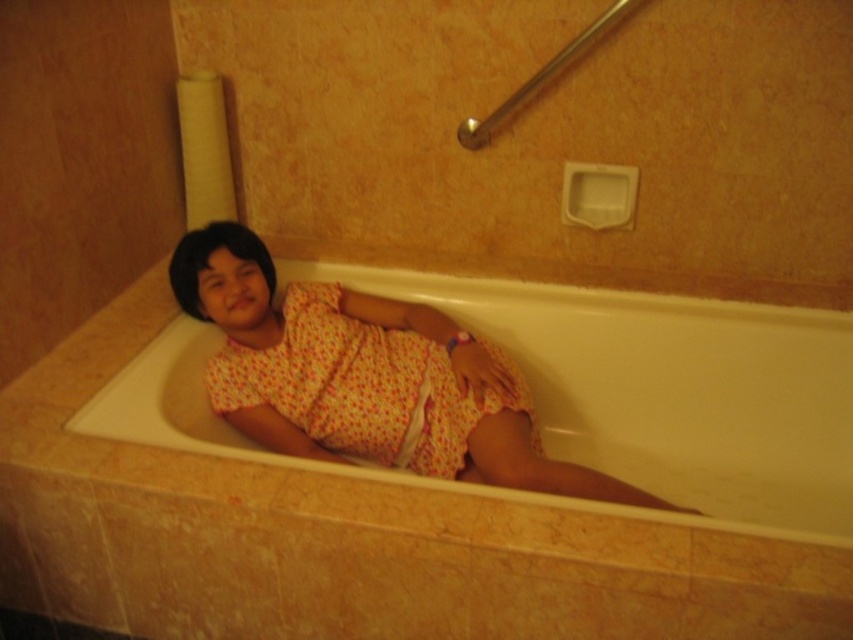
Is the position of floral fabric dress at center less distant than that of floral cotton dress at center?

Yes, it is in front of floral cotton dress at center.

Image resolution: width=853 pixels, height=640 pixels. In order to click on floral fabric dress at center in this screenshot , I will do `click(364, 376)`.